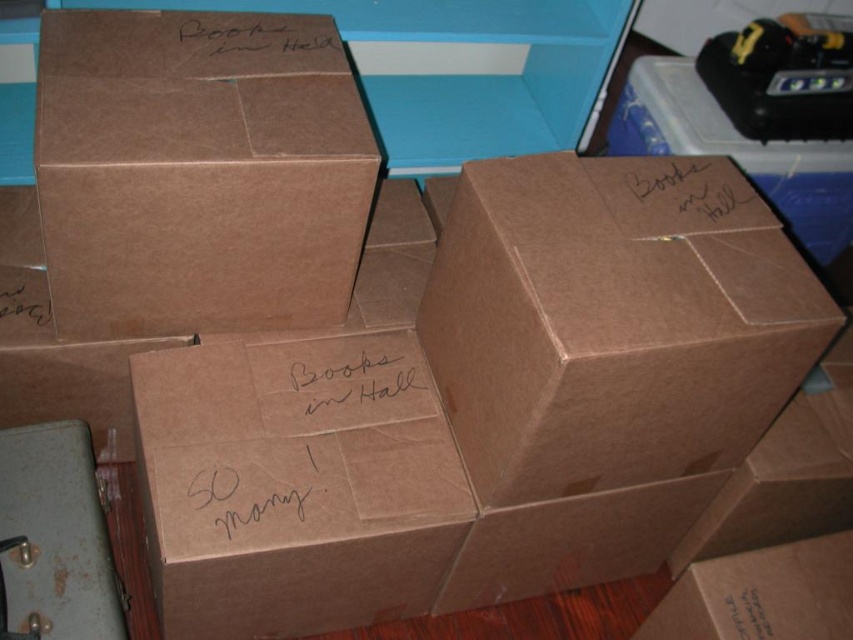
Question: Which point appears closest to the camera in this image?

Choices:
 (A) (236, 520)
 (B) (97, 273)
 (C) (657, 200)
 (D) (370, 387)

Answer: (A)

Question: Considering the relative positions of brown cardboard box at upper left and brown cardboard box at upper right in the image provided, where is brown cardboard box at upper left located with respect to brown cardboard box at upper right?

Choices:
 (A) left
 (B) right

Answer: (A)

Question: Can you confirm if brown cardboard box at upper right is thinner than handwritten brown paper at upper right?

Choices:
 (A) yes
 (B) no

Answer: (B)

Question: Which of the following is the closest to the observer?

Choices:
 (A) black paper at lower left
 (B) handwritten brown paper at upper right

Answer: (B)

Question: Does brown cardboard box at center appear on the left side of black paper at lower left?

Choices:
 (A) no
 (B) yes

Answer: (A)

Question: Which point is farther to the camera?

Choices:
 (A) (212, 49)
 (B) (26, 301)

Answer: (B)